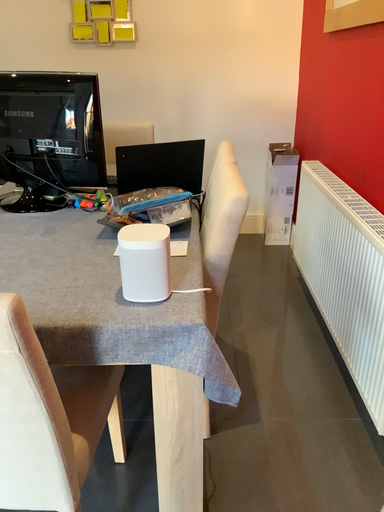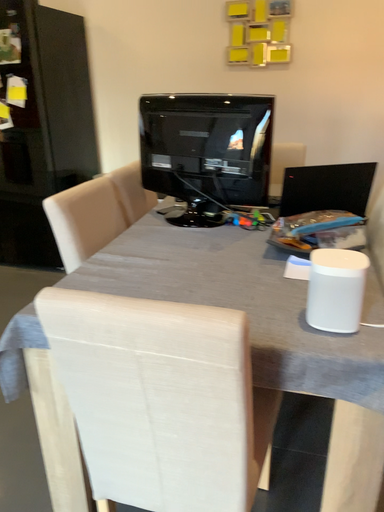
Question: Which way did the camera rotate in the video?

Choices:
 (A) rotated right
 (B) rotated left

Answer: (B)